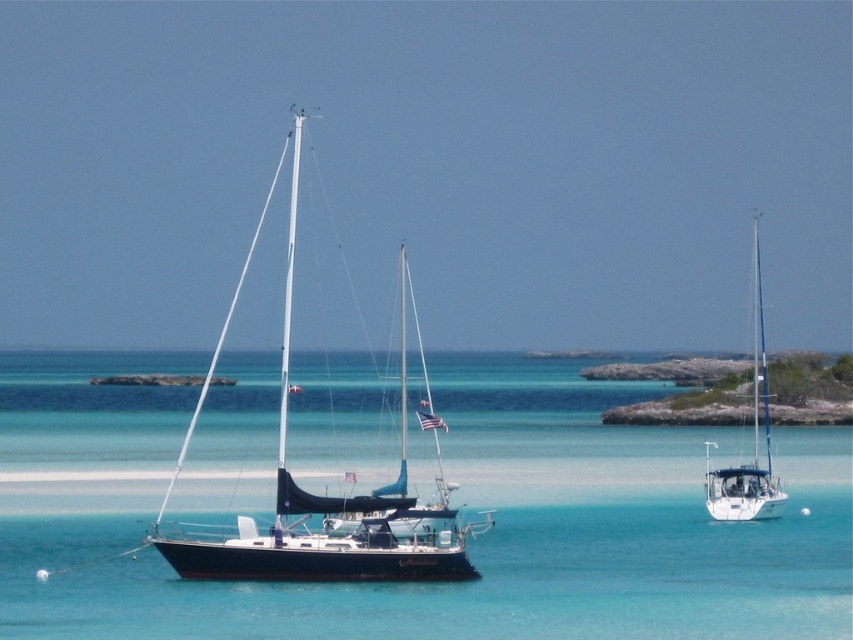
Can you confirm if clear blue water at center is positioned to the left of white glossy sailboat at right?

Yes, clear blue water at center is to the left of white glossy sailboat at right.

Find the location of a particular element. Image resolution: width=853 pixels, height=640 pixels. clear blue water at center is located at coordinates (450, 500).

Image resolution: width=853 pixels, height=640 pixels. What are the coordinates of `clear blue water at center` in the screenshot? It's located at (450, 500).